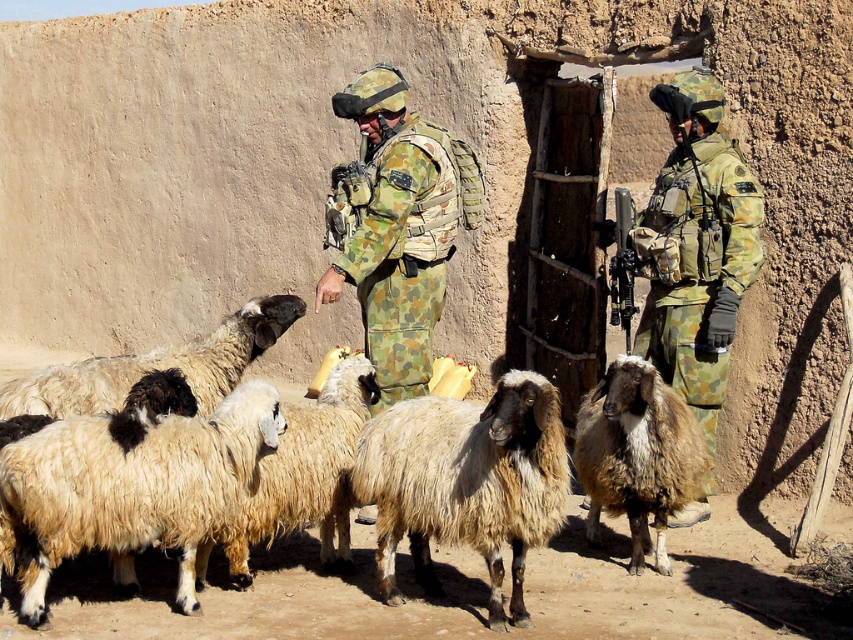
Question: Which object is the closest to the fuzzy beige wool at center?

Choices:
 (A) black woolen sheep at center
 (B) fuzzy brown goat at center

Answer: (B)

Question: Among these objects, which one is farthest from the camera?

Choices:
 (A) fuzzy woolen sheep at lower left
 (B) camouflage fabric uniform at center
 (C) fuzzy brown goat at center
 (D) camouflage uniform at center

Answer: (D)

Question: Does fuzzy woolen sheep at lower left have a lesser width compared to camouflage fabric uniform at center?

Choices:
 (A) no
 (B) yes

Answer: (A)

Question: Which point is farther to the camera?

Choices:
 (A) black woolen sheep at center
 (B) camouflage uniform at center
 (C) camouflage fabric uniform at center
 (D) fuzzy woolen sheep at lower left

Answer: (B)

Question: Does camouflage uniform at center appear under camouflage fabric uniform at center?

Choices:
 (A) yes
 (B) no

Answer: (A)

Question: Does camouflage uniform at center appear over fuzzy woolen sheep at center?

Choices:
 (A) no
 (B) yes

Answer: (B)